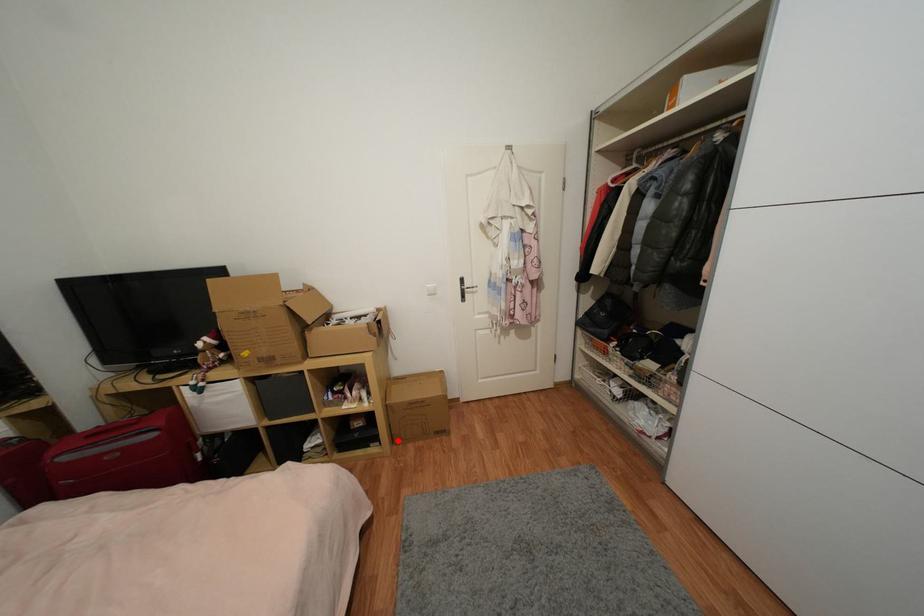
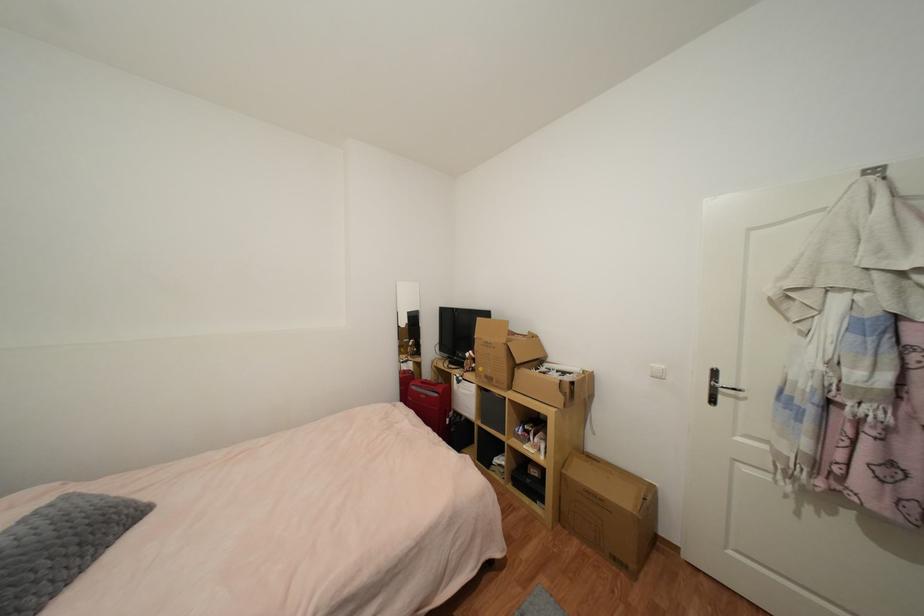
Question: I am providing you with two images of the same scene from different viewpoints. Image1 has a red point marked. In image2, the corresponding 3D location appears at what relative position? Reply with the corresponding letter.

Choices:
 (A) Closer
 (B) Farther

Answer: (A)